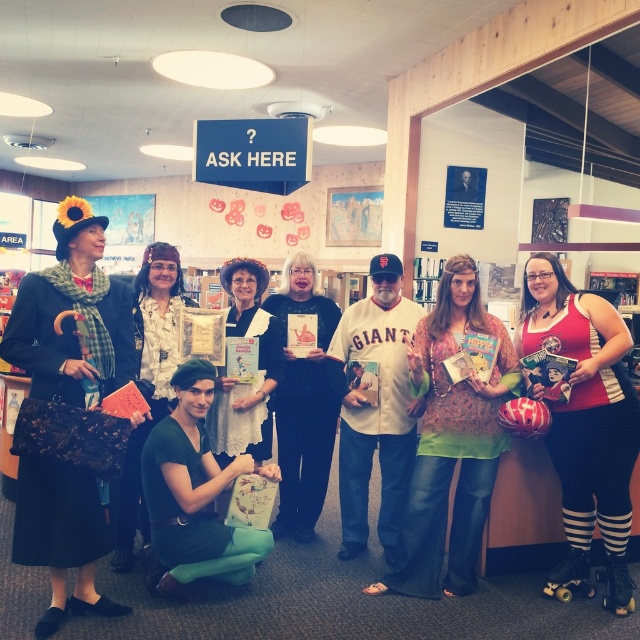
Is point (620, 362) behind point (449, 406)?

Yes, point (620, 362) is farther from viewer.

Consider the image. Who is lower down, red and white striped leggings at center or floral-patterned blouse at center?

floral-patterned blouse at center is below.

Who is more forward, (620, 602) or (467, 515)?

Point (620, 602) is more forward.

Where is `red and white striped leggings at center`? The image size is (640, 640). red and white striped leggings at center is located at coordinates (584, 422).

Between matte black coat at left and floral-patterned blouse at center, which one has less height?

Standing shorter between the two is matte black coat at left.

Can you confirm if matte black coat at left is shorter than floral-patterned blouse at center?

Yes, matte black coat at left is shorter than floral-patterned blouse at center.

Between point (61, 342) and point (468, 552), which one is positioned in front?

Point (61, 342)

What are the coordinates of `matte black coat at left` in the screenshot? It's located at (70, 314).

Can you confirm if red and white striped leggings at center is taller than white jersey at center?

Yes.

Does red and white striped leggings at center appear on the left side of white jersey at center?

Incorrect, red and white striped leggings at center is not on the left side of white jersey at center.

Is point (570, 513) in front of point (385, 444)?

Yes.

Where is `red and white striped leggings at center`? The image size is (640, 640). red and white striped leggings at center is located at coordinates (584, 422).